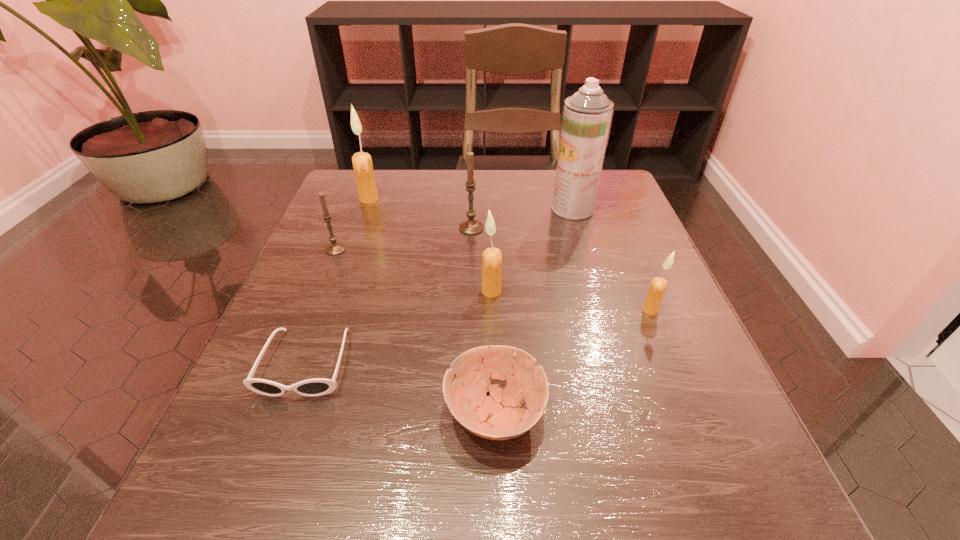
In the image, there is a desktop. At what (x,y) coordinates should I click in order to perform the action: click on vacant space at the left edge. Please return your answer as a coordinate pair (x, y). Image resolution: width=960 pixels, height=540 pixels. Looking at the image, I should click on pyautogui.click(x=309, y=281).

Locate an element on the screen. This screenshot has width=960, height=540. vacant point at the right edge is located at coordinates (601, 245).

The height and width of the screenshot is (540, 960). In the image, there is a desktop. Find the location of `vacant space at the far left corner`. vacant space at the far left corner is located at coordinates (339, 207).

Locate an element on the screen. The height and width of the screenshot is (540, 960). vacant space at the near right corner of the desktop is located at coordinates (718, 509).

Identify the location of free area in between the rightmost candle and the farthest candle. (510, 254).

Image resolution: width=960 pixels, height=540 pixels. Identify the location of empty space between the second object from right to left and the sixth nearest object. (522, 218).

The image size is (960, 540). In order to click on free space between the second shortest object and the nearest cream candle in this screenshot , I will do `click(572, 361)`.

You are a GUI agent. You are given a task and a screenshot of the screen. Output one action in this format:
    pyautogui.click(x=<x>, y=<y>)
    Task: Click on the free space between the second farthest cream candle and the leftmost cream candle
    
    Given the screenshot: What is the action you would take?
    430,245

Find the location of a particular element. The width and height of the screenshot is (960, 540). unoccupied area between the smaller gray candle and the fourth farthest candle is located at coordinates (414, 271).

The image size is (960, 540). Find the location of `vacant area between the seventh object from left to right and the rightmost cream candle`. vacant area between the seventh object from left to right and the rightmost cream candle is located at coordinates pos(612,259).